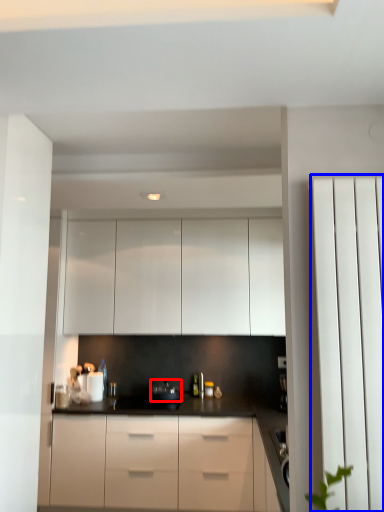
Question: Which point is further to the camera, appliance (highlighted by a red box) or screen door (highlighted by a blue box)?

Choices:
 (A) appliance
 (B) screen door

Answer: (A)